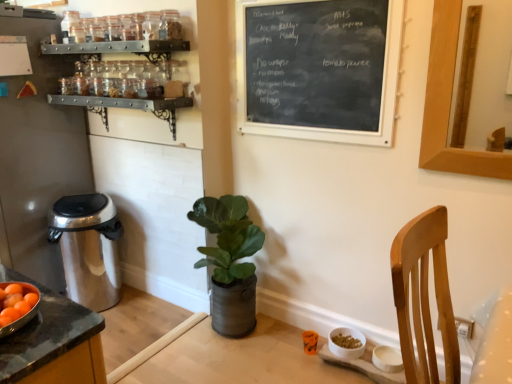
Question: Is metallic spice rack at upper left, the first shelf from the top, with green leafy plant in metallic pot at center?

Choices:
 (A) yes
 (B) no

Answer: (B)

Question: Is metallic spice rack at upper left, the first shelf from the top, oriented away from green leafy plant in metallic pot at center?

Choices:
 (A) yes
 (B) no

Answer: (B)

Question: From a real-world perspective, does metallic spice rack at upper left, the first shelf from the top, sit lower than green leafy plant in metallic pot at center?

Choices:
 (A) yes
 (B) no

Answer: (B)

Question: Can you confirm if metallic spice rack at upper left, placed as the 2th shelf when sorted from bottom to top, is wider than green leafy plant in metallic pot at center?

Choices:
 (A) no
 (B) yes

Answer: (A)

Question: Is metallic spice rack at upper left, the first shelf from the top, at the right side of green leafy plant in metallic pot at center?

Choices:
 (A) yes
 (B) no

Answer: (B)

Question: Considering the positions of point click(45, 187) and point click(94, 253), is point click(45, 187) closer or farther from the camera than point click(94, 253)?

Choices:
 (A) closer
 (B) farther

Answer: (B)

Question: Based on their positions, is brushed metal trash can at left located to the left or right of satin silver trash can at left?

Choices:
 (A) left
 (B) right

Answer: (A)

Question: In terms of size, does brushed metal trash can at left appear bigger or smaller than satin silver trash can at left?

Choices:
 (A) small
 (B) big

Answer: (B)

Question: From their relative heights in the image, would you say brushed metal trash can at left is taller or shorter than satin silver trash can at left?

Choices:
 (A) tall
 (B) short

Answer: (A)

Question: Based on their sizes in the image, would you say brushed metal trash can at left is bigger or smaller than metallic spice rack at upper left, the first shelf from the top?

Choices:
 (A) big
 (B) small

Answer: (A)

Question: From their relative heights in the image, would you say brushed metal trash can at left is taller or shorter than metallic spice rack at upper left, the first shelf from the top?

Choices:
 (A) short
 (B) tall

Answer: (B)

Question: Is point (70, 56) positioned closer to the camera than point (49, 52)?

Choices:
 (A) farther
 (B) closer

Answer: (A)

Question: Considering their positions, is brushed metal trash can at left located in front of or behind metallic spice rack at upper left, the first shelf from the top?

Choices:
 (A) front
 (B) behind

Answer: (B)

Question: Is point (347, 38) closer or farther from the camera than point (39, 59)?

Choices:
 (A) closer
 (B) farther

Answer: (A)

Question: Is black chalkboard at upper center inside or outside of brushed metal trash can at left?

Choices:
 (A) inside
 (B) outside

Answer: (B)